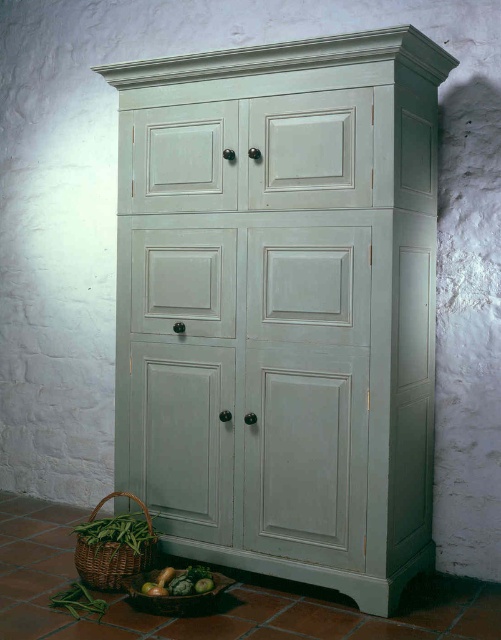
You are organizing vegetables in the kitchen. You have a woven brown basket at lower left and a green matte cucumber at lower center. Which container can hold the cucumber without it sticking out?

The woven brown basket at lower left is much taller than the green matte cucumber at lower center, so it can hold the cucumber without it sticking out.

You are standing in front of the cabinet and want to place a decorative item on the floor between the two points, point (x=85, y=554) and point (x=149, y=584). Which point is closer to you so that you can place the item in front of it?

Point (x=85, y=554) is closer to you than point (x=149, y=584), so placing the item in front of point (x=85, y=554) would position it closer to your current location.